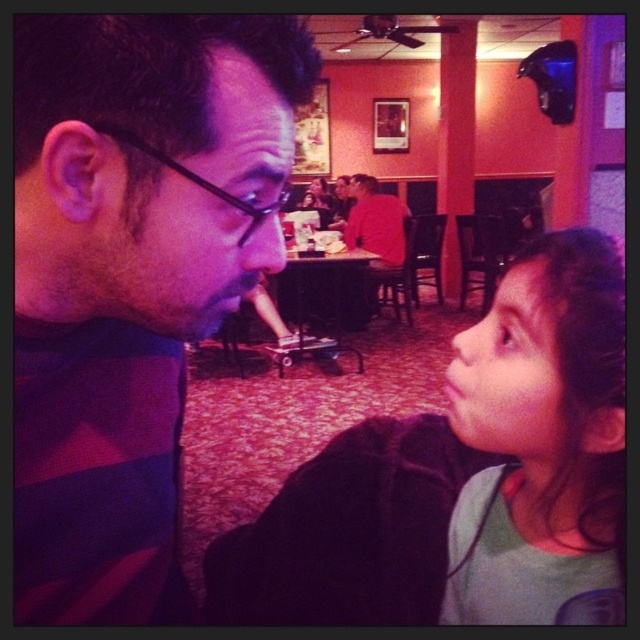
You are a waiter in a restaurant. You see a customer wearing a matte black jacket at lower right and another wearing a light green fabric shirt at right. Which customer is closer to the left side of the restaurant?

The matte black jacket at lower right is to the left of the light green fabric shirt at right, so the customer wearing the matte black jacket at lower right is closer to the left side of the restaurant.

You are standing at the center of the room and want to move to the matte black jacket at lower right. Which direction should you move in to reach it?

Since the matte black jacket at lower right is located at coordinates point (465,477), you should move towards the lower right direction to reach it.